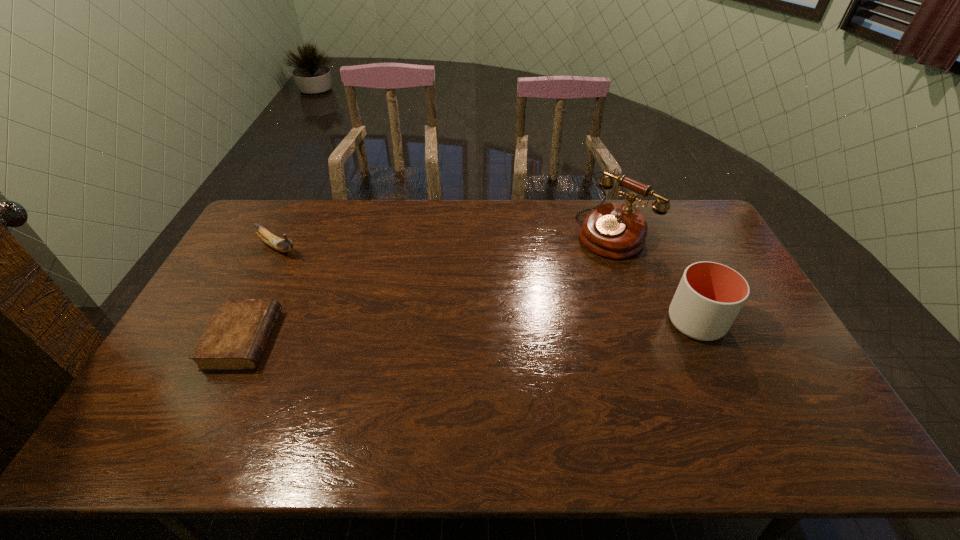
Locate an element on the screen. This screenshot has width=960, height=540. empty space that is in between the second tallest object and the tallest object is located at coordinates pos(656,277).

Locate an element on the screen. free space between the telephone and the second shortest object is located at coordinates (446, 240).

Find the location of a particular element. This screenshot has width=960, height=540. vacant area that lies between the tallest object and the banana is located at coordinates (446, 240).

Select which object is the closest to the banana. Please provide its 2D coordinates. Your answer should be formatted as a tuple, i.e. [(x, y)], where the tuple contains the x and y coordinates of a point satisfying the conditions above.

[(235, 339)]

The image size is (960, 540). Identify the location of object that stands as the second closest to the cup. (235, 339).

The width and height of the screenshot is (960, 540). Identify the location of blank area in the image that satisfies the following two spatial constraints: 1. on the front side of the third tallest object; 2. on the left side of the third shortest object. (240, 322).